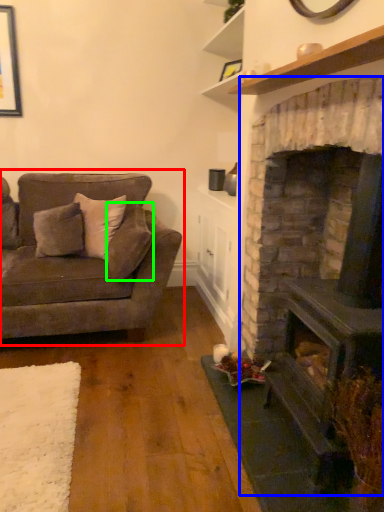
Question: Estimate the real-world distances between objects in this image. Which object is farther from studio couch (highlighted by a red box), fireplace (highlighted by a blue box) or pillow (highlighted by a green box)?

Choices:
 (A) fireplace
 (B) pillow

Answer: (A)